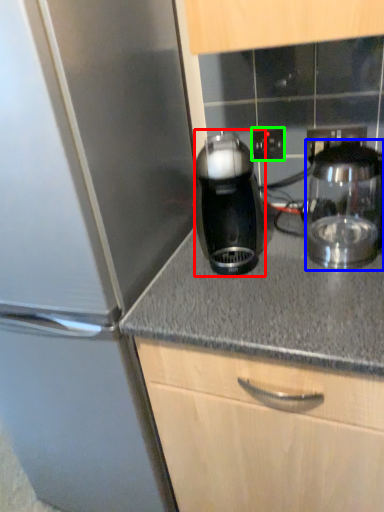
Question: Estimate the real-world distances between objects in this image. Which object is closer to kitchen appliance (highlighted by a red box), kitchen appliance (highlighted by a blue box) or electric outlet (highlighted by a green box)?

Choices:
 (A) kitchen appliance
 (B) electric outlet

Answer: (A)